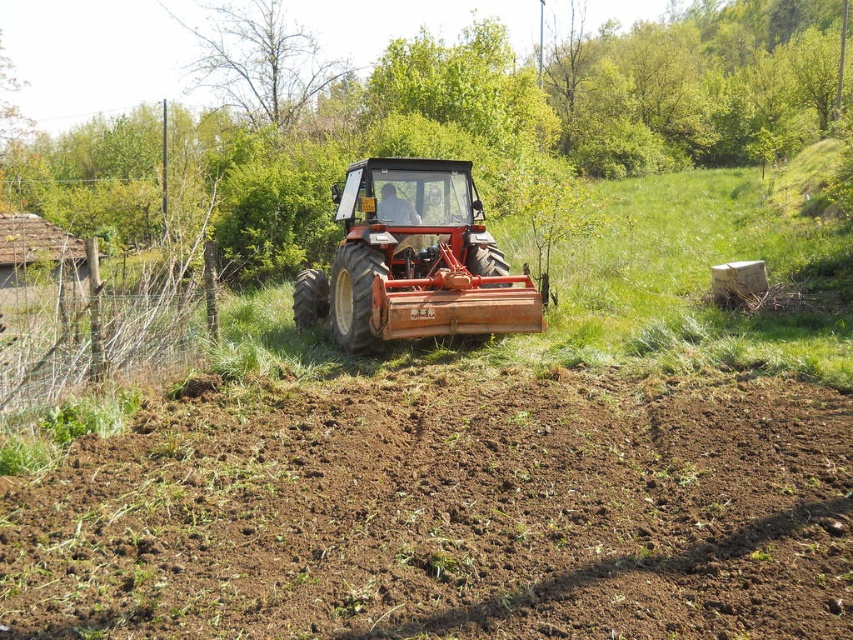
Who is lower down, brown soil at center or orange metal plow at center?

brown soil at center

Find the location of a particular element. brown soil at center is located at coordinates click(448, 513).

Is point (126, 541) closer to viewer compared to point (308, 289)?

Yes, point (126, 541) is closer to viewer.

This screenshot has width=853, height=640. I want to click on brown soil at center, so click(448, 513).